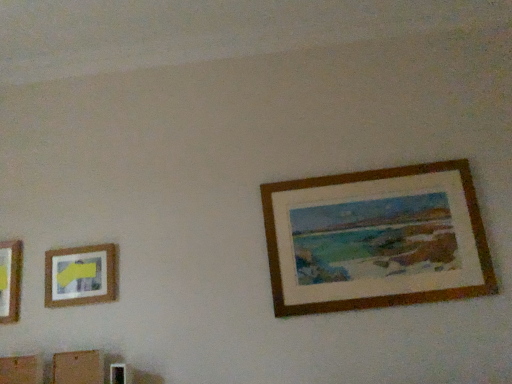
Question: Can you confirm if matte wooden picture frame at left, arranged as the first picture frame when viewed from the left, is positioned to the right of wooden picture frame at upper right, acting as the 1th picture frame starting from the right?

Choices:
 (A) yes
 (B) no

Answer: (B)

Question: Considering the relative positions of matte wooden picture frame at left, marked as the 2th picture frame in a right-to-left arrangement, and wooden picture frame at upper right, which ranks as the second picture frame in left-to-right order, in the image provided, is matte wooden picture frame at left, marked as the 2th picture frame in a right-to-left arrangement, to the left of wooden picture frame at upper right, which ranks as the second picture frame in left-to-right order, from the viewer's perspective?

Choices:
 (A) yes
 (B) no

Answer: (A)

Question: From a real-world perspective, does matte wooden picture frame at left, arranged as the first picture frame when viewed from the left, stand above wooden picture frame at upper right, which ranks as the second picture frame in left-to-right order?

Choices:
 (A) yes
 (B) no

Answer: (B)

Question: Does matte wooden picture frame at left, marked as the 2th picture frame in a right-to-left arrangement, lie behind wooden picture frame at upper right, which ranks as the second picture frame in left-to-right order?

Choices:
 (A) no
 (B) yes

Answer: (B)

Question: Considering the relative sizes of matte wooden picture frame at left, marked as the 2th picture frame in a right-to-left arrangement, and wooden picture frame at upper right, acting as the 1th picture frame starting from the right, in the image provided, is matte wooden picture frame at left, marked as the 2th picture frame in a right-to-left arrangement, bigger than wooden picture frame at upper right, acting as the 1th picture frame starting from the right,?

Choices:
 (A) no
 (B) yes

Answer: (A)

Question: Is matte wooden picture frame at left, marked as the 2th picture frame in a right-to-left arrangement, shorter than wooden picture frame at upper right, acting as the 1th picture frame starting from the right?

Choices:
 (A) no
 (B) yes

Answer: (B)

Question: Could you tell me if wooden picture frame at upper right, which ranks as the second picture frame in left-to-right order, is facing matte wooden picture frame at left, arranged as the first picture frame when viewed from the left?

Choices:
 (A) yes
 (B) no

Answer: (B)

Question: Is wooden picture frame at upper right, which ranks as the second picture frame in left-to-right order, in contact with matte wooden picture frame at left, arranged as the first picture frame when viewed from the left?

Choices:
 (A) yes
 (B) no

Answer: (B)

Question: Can you confirm if wooden picture frame at upper right, acting as the 1th picture frame starting from the right, is shorter than matte wooden picture frame at left, marked as the 2th picture frame in a right-to-left arrangement?

Choices:
 (A) yes
 (B) no

Answer: (B)

Question: From the image's perspective, is wooden picture frame at upper right, acting as the 1th picture frame starting from the right, below matte wooden picture frame at left, marked as the 2th picture frame in a right-to-left arrangement?

Choices:
 (A) yes
 (B) no

Answer: (B)

Question: Is wooden picture frame at upper right, acting as the 1th picture frame starting from the right, wider than matte wooden picture frame at left, marked as the 2th picture frame in a right-to-left arrangement?

Choices:
 (A) yes
 (B) no

Answer: (A)

Question: Is matte wooden picture frame at left, marked as the 2th picture frame in a right-to-left arrangement, at the back of wooden picture frame at upper right, which ranks as the second picture frame in left-to-right order?

Choices:
 (A) no
 (B) yes

Answer: (A)

Question: Considering the positions of wooden picture frame at upper right, which ranks as the second picture frame in left-to-right order, and matte wooden picture frame at left, marked as the 2th picture frame in a right-to-left arrangement, in the image, is wooden picture frame at upper right, which ranks as the second picture frame in left-to-right order, taller or shorter than matte wooden picture frame at left, marked as the 2th picture frame in a right-to-left arrangement,?

Choices:
 (A) short
 (B) tall

Answer: (B)